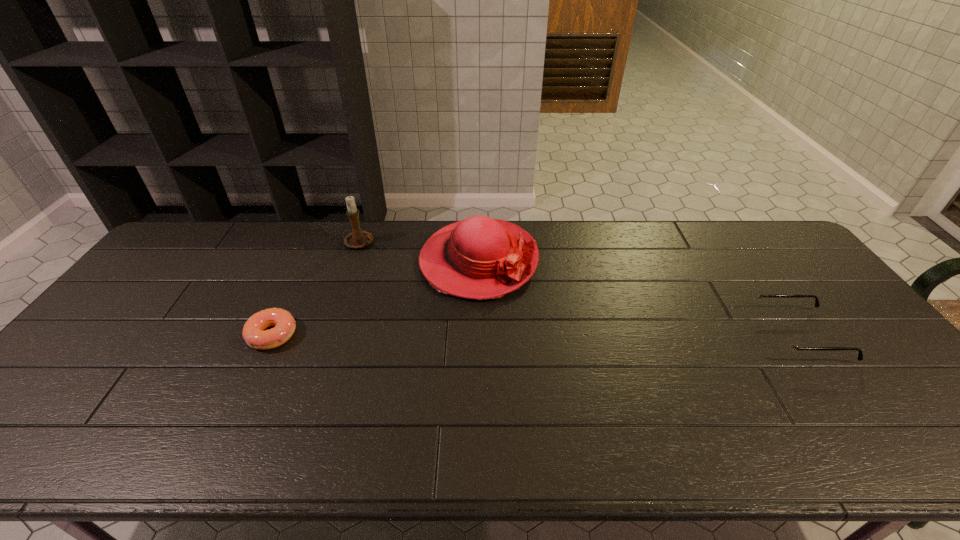
Image resolution: width=960 pixels, height=540 pixels. Find the location of `free spot between the hat and the candle holder`. free spot between the hat and the candle holder is located at coordinates (420, 252).

Where is `free area in between the tallest object and the third shortest object`? free area in between the tallest object and the third shortest object is located at coordinates (420, 252).

The height and width of the screenshot is (540, 960). I want to click on vacant space that is in between the leftmost object and the second shortest object, so click(x=536, y=335).

Image resolution: width=960 pixels, height=540 pixels. Find the location of `vacant point located between the third object from right to left and the third tallest object`. vacant point located between the third object from right to left and the third tallest object is located at coordinates pyautogui.click(x=580, y=289).

I want to click on free spot between the third object from left to right and the candle holder, so click(x=420, y=252).

The height and width of the screenshot is (540, 960). I want to click on free space between the shortest object and the second object from right to left, so click(x=375, y=298).

Identify the location of object that ranks as the third closest to the hat. (783, 342).

The height and width of the screenshot is (540, 960). I want to click on object that stands as the closest to the doughnut, so click(x=479, y=258).